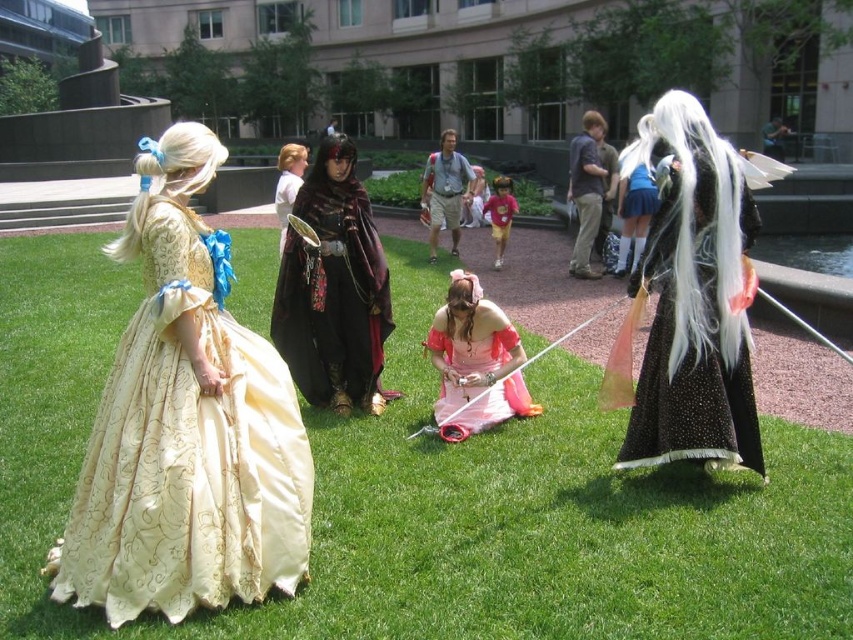
Question: Which object is positioned farthest from the matte black armor at center?

Choices:
 (A) velvet maroon cape at center
 (B) green grass at lower left
 (C) black dotted fabric dress at right

Answer: (C)

Question: Can you confirm if gold satin dress at left is bigger than silky white wig at upper right?

Choices:
 (A) yes
 (B) no

Answer: (B)

Question: Based on their relative distances, which object is farther from the light brown leather backpack at center?

Choices:
 (A) silky white wig at upper right
 (B) matte black armor at center
 (C) pink satin dress at center

Answer: (C)

Question: Which of the following is the farthest from the observer?

Choices:
 (A) (321, 208)
 (B) (207, 461)

Answer: (A)

Question: Where is silky white wig at upper right located in relation to light brown leather backpack at center in the image?

Choices:
 (A) above
 (B) below

Answer: (B)

Question: Does gold satin dress at left have a larger size compared to silky white wig at upper right?

Choices:
 (A) yes
 (B) no

Answer: (B)